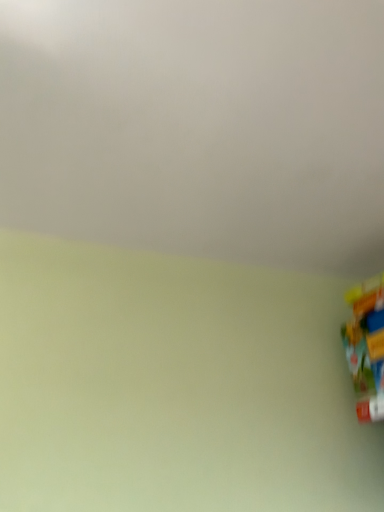
The height and width of the screenshot is (512, 384). What do you see at coordinates (366, 347) in the screenshot? I see `plastic toy at lower right` at bounding box center [366, 347].

Locate an element on the screen. Image resolution: width=384 pixels, height=512 pixels. plastic toy at lower right is located at coordinates (366, 347).

The width and height of the screenshot is (384, 512). I want to click on plastic toy at lower right, so click(x=366, y=347).